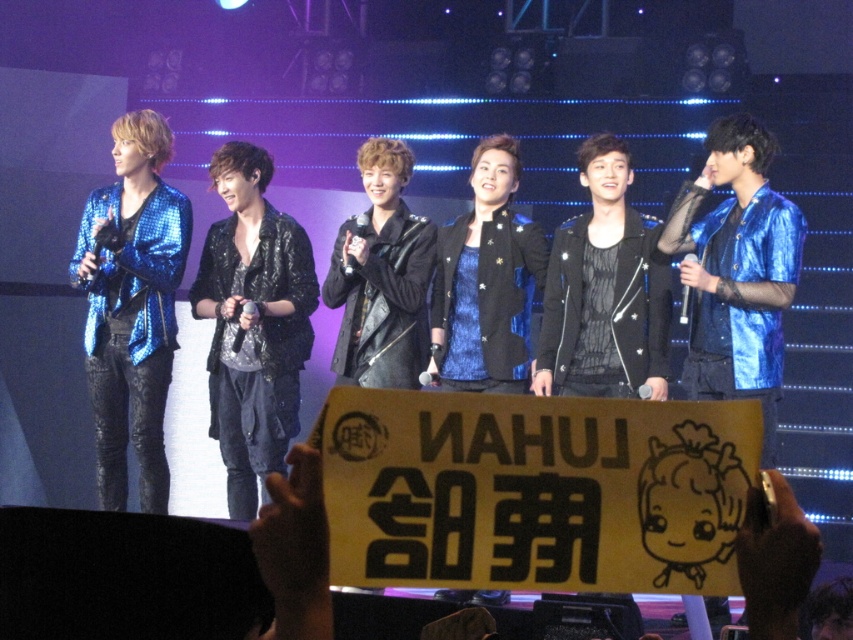
You are a photographer at the concert. You want to take a photo that includes both the shiny black jacket at center and the shiny blue jacket at right. Which jacket should you zoom in on to ensure both are clearly visible in the frame?

The shiny black jacket at center is smaller than the shiny blue jacket at right. To ensure both are clearly visible, you should zoom out slightly so that the larger shiny blue jacket at right doesn not dominate the frame, allowing space for the smaller shiny black jacket at center.

You are a photographer at the concert wanting to capture both the shiny blue jacket at right and the black leather jacket at center in a single frame. Given that your camera has a fixed focal length, which jacket should you focus on to ensure both are in focus without moving the camera?

You should focus on the black leather jacket at center because the shiny blue jacket at right is wider than the black leather jacket at center. By focusing on the closer object, you can ensure both are in focus.

You are a photographer at the concert and want to focus on the fan sign and the performers. Given the two points in the image, which point is closer to you, point(714, 312) or point(355, 326)?

Point(714, 312) is closer to the viewer than point(355, 326).